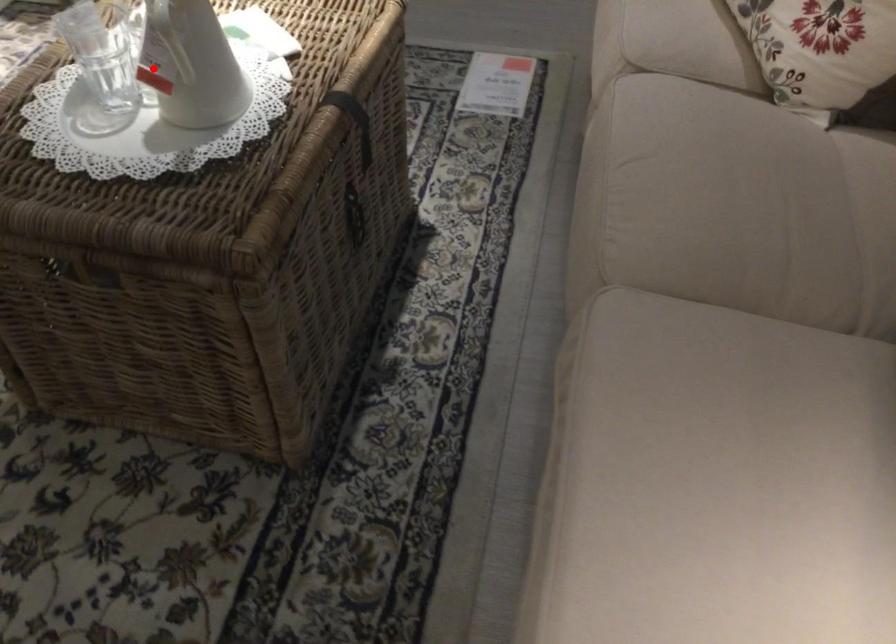
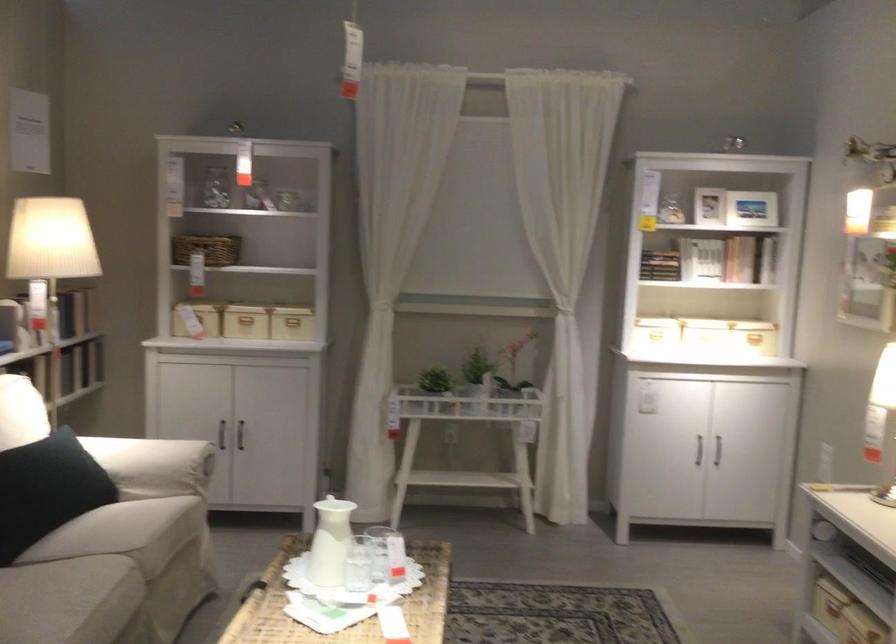
Question: I am providing you with two images of the same scene from different viewpoints. Image1 has a red point marked. In image2, the corresponding 3D location appears at what relative position? Reply with the corresponding letter.

Choices:
 (A) Closer
 (B) Farther

Answer: (B)